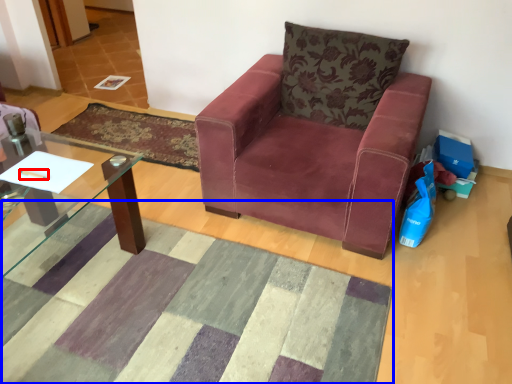
Question: Among these objects, which one is nearest to the camera, pen (highlighted by a red box) or mat (highlighted by a blue box)?

Choices:
 (A) pen
 (B) mat

Answer: (B)